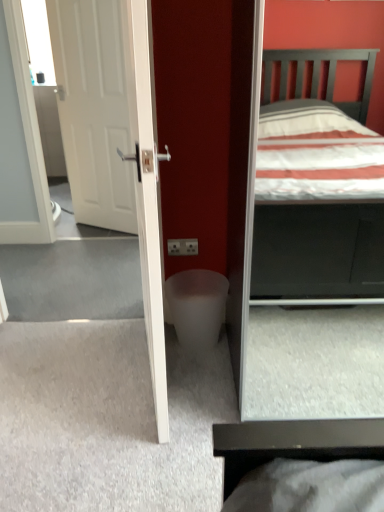
Question: Considering the positions of white matte door at left and white frosted glass at center in the image, is white matte door at left bigger or smaller than white frosted glass at center?

Choices:
 (A) big
 (B) small

Answer: (A)

Question: Considering the positions of white matte door at left and white frosted glass at center in the image, is white matte door at left wider or thinner than white frosted glass at center?

Choices:
 (A) thin
 (B) wide

Answer: (A)

Question: Do you think white matte door at left is within white frosted glass at center, or outside of it?

Choices:
 (A) outside
 (B) inside

Answer: (A)

Question: Which is correct: white frosted glass at center is inside white matte door at left, or outside of it?

Choices:
 (A) inside
 (B) outside

Answer: (B)

Question: Based on their sizes in the image, would you say white frosted glass at center is bigger or smaller than white matte door at left?

Choices:
 (A) small
 (B) big

Answer: (A)

Question: Considering the positions of white frosted glass at center and white matte door at left in the image, is white frosted glass at center taller or shorter than white matte door at left?

Choices:
 (A) short
 (B) tall

Answer: (A)

Question: Is point (170, 294) closer or farther from the camera than point (69, 78)?

Choices:
 (A) farther
 (B) closer

Answer: (B)